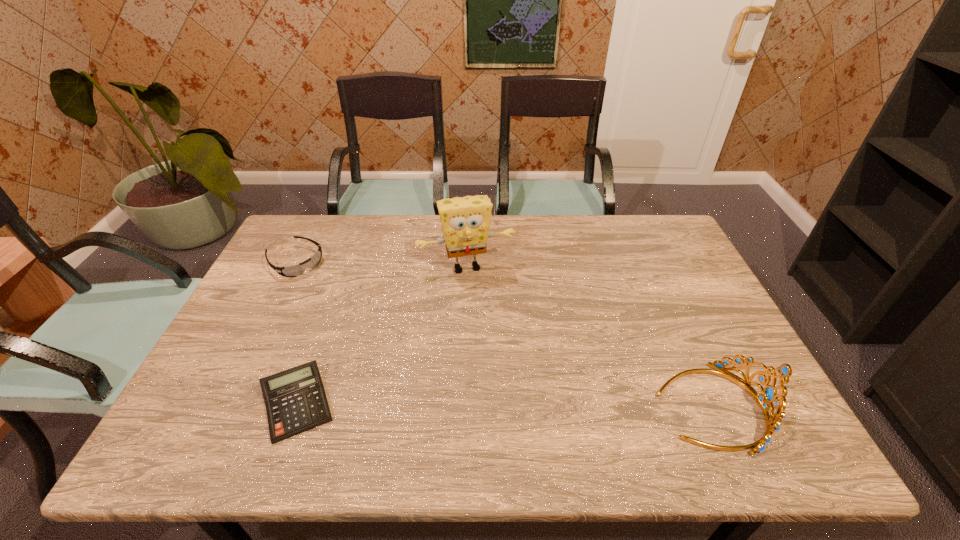
Where is `free space on the desktop that is between the calculator and the third shortest object and is positioned on the lenses of the sunglasses`? Image resolution: width=960 pixels, height=540 pixels. free space on the desktop that is between the calculator and the third shortest object and is positioned on the lenses of the sunglasses is located at coordinates (472, 405).

The image size is (960, 540). Identify the location of free space on the desktop that is between the shortest object and the rightmost object and is positioned on the face of the tallest object. (509, 405).